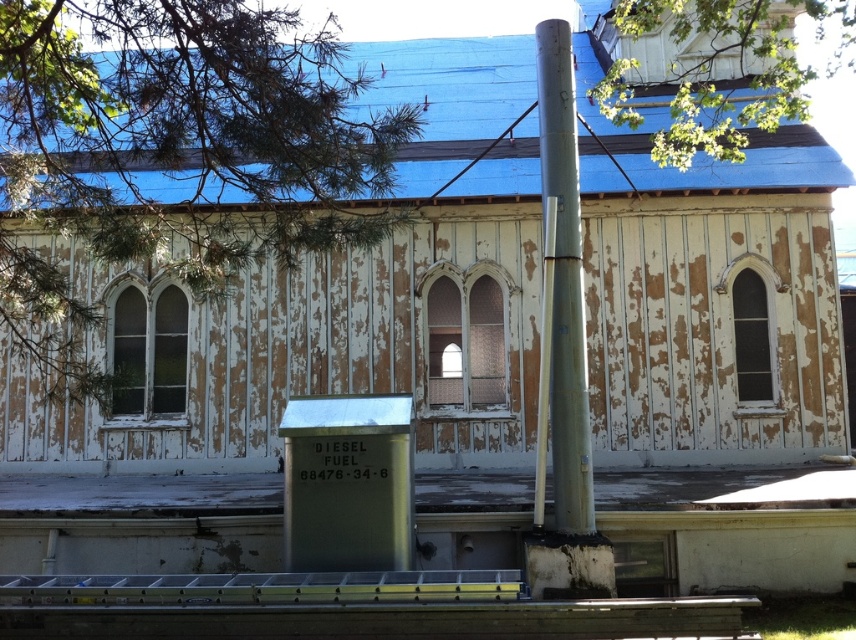
You are a delivery driver who needs to park your truck near the silver metallic pole at center. However, there is a green leafy tree at upper center in the way. Will the tree block the truck from accessing the pole?

The green leafy tree at upper center is located above the silver metallic pole at center, so it will not block the truck from accessing the pole since it is positioned above and not in front of it.

You are a delivery driver approaching the old building and need to park your truck between the green leafy tree at upper center and the silver metallic pole at center. Can you fit your truck there?

The green leafy tree at upper center is further to the viewer than the silver metallic pole at center, so the distance between them may be insufficient for parking the truck. Check the space carefully before attempting to park.